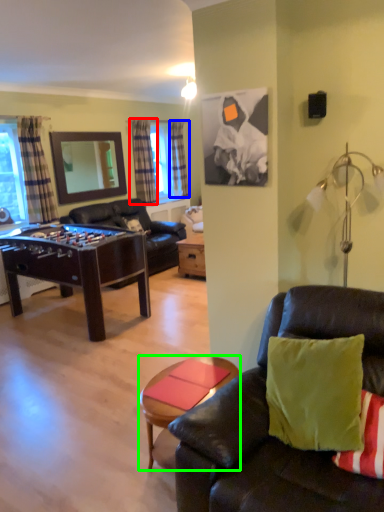
Question: Based on their relative distances, which object is nearer to curtain (highlighted by a red box)? Choose from curtain (highlighted by a blue box) and coffee table (highlighted by a green box).

Choices:
 (A) curtain
 (B) coffee table

Answer: (A)